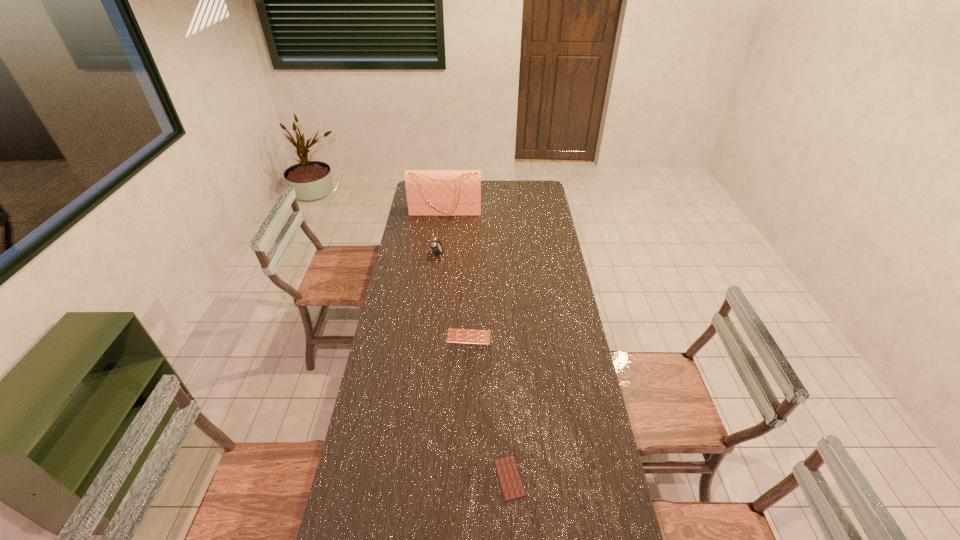
At what (x,y) coordinates should I click in order to perform the action: click on free space that is in between the third nearest object and the farthest object. Please return your answer as a coordinate pair (x, y). The width and height of the screenshot is (960, 540). Looking at the image, I should click on (442, 233).

This screenshot has height=540, width=960. In order to click on free area in between the second tallest object and the third farthest object in this screenshot , I will do `click(453, 295)`.

Locate an element on the screen. This screenshot has width=960, height=540. free space between the farthest object and the taller chocolate bar is located at coordinates pos(457,274).

Image resolution: width=960 pixels, height=540 pixels. Identify the location of vacant point located between the farther chocolate bar and the tallest object. (457, 274).

Where is `empty location between the handbag and the taller chocolate bar`? empty location between the handbag and the taller chocolate bar is located at coordinates (457, 274).

Locate an element on the screen. vacant region between the tallest object and the second tallest object is located at coordinates (442, 233).

At what (x,y) coordinates should I click in order to perform the action: click on free area in between the third farthest object and the shortest object. Please return your answer as a coordinate pair (x, y). The width and height of the screenshot is (960, 540). Looking at the image, I should click on (489, 407).

Select which object is the third closest to the second nearest object. Please provide its 2D coordinates. Your answer should be formatted as a tuple, i.e. [(x, y)], where the tuple contains the x and y coordinates of a point satisfying the conditions above.

[(429, 192)]

You are a GUI agent. You are given a task and a screenshot of the screen. Output one action in this format:
    pyautogui.click(x=<x>, y=<y>)
    Task: Click on the object that ranks as the closest to the farthest object
    This screenshot has height=540, width=960.
    Given the screenshot: What is the action you would take?
    pyautogui.click(x=437, y=248)

The height and width of the screenshot is (540, 960). I want to click on vacant area in the image that satisfies the following two spatial constraints: 1. on the front-facing side of the farthest object; 2. on the face of the second farthest object, so point(441,254).